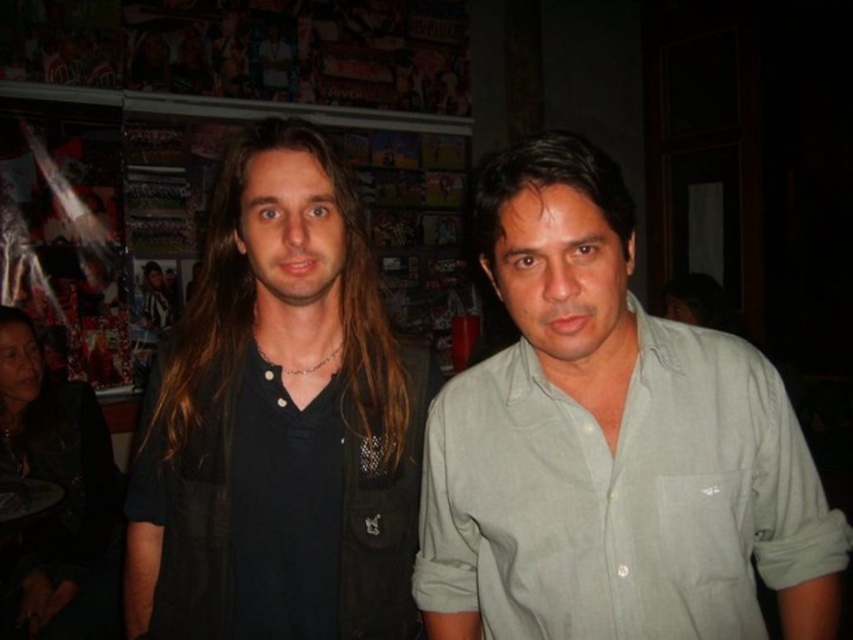
Measure the distance between point (x=581, y=200) and camera.

Point (x=581, y=200) and camera are 28.06 inches apart from each other.

Between light green cotton shirt at center and black matte shirt at center, which one appears on the left side from the viewer's perspective?

Positioned to the left is black matte shirt at center.

Which is behind, point (532, 250) or point (294, 240)?

The point (294, 240) is behind.

I want to click on light green cotton shirt at center, so click(608, 444).